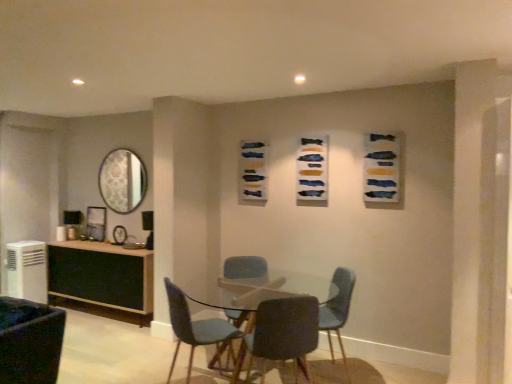
Question: Is textured fabric artwork at center, the third art when ordered from front to back, to the right of clear glass table at center from the viewer's perspective?

Choices:
 (A) yes
 (B) no

Answer: (B)

Question: Can you confirm if textured fabric artwork at center, the 1th art viewed from the back, is taller than clear glass table at center?

Choices:
 (A) yes
 (B) no

Answer: (B)

Question: Is textured fabric artwork at center, the third art when ordered from front to back, outside of clear glass table at center?

Choices:
 (A) yes
 (B) no

Answer: (A)

Question: Is textured fabric artwork at center, which is counted as the 1th art, starting from the left, next to clear glass table at center?

Choices:
 (A) yes
 (B) no

Answer: (B)

Question: Does textured fabric artwork at center, the 1th art viewed from the back, lie behind clear glass table at center?

Choices:
 (A) no
 (B) yes

Answer: (B)

Question: Is velvet blue chair at center, placed as the fourth chair when sorted from left to right, in front of or behind silver/metallic mirror at upper left in the image?

Choices:
 (A) behind
 (B) front

Answer: (B)

Question: Based on their positions, is velvet blue chair at center, which is counted as the 2th chair, starting from the right, located to the left or right of silver/metallic mirror at upper left?

Choices:
 (A) right
 (B) left

Answer: (A)

Question: Looking at the image, does velvet blue chair at center, which is counted as the 2th chair, starting from the right, seem bigger or smaller compared to silver/metallic mirror at upper left?

Choices:
 (A) big
 (B) small

Answer: (A)

Question: From the image's perspective, relative to silver/metallic mirror at upper left, is velvet blue chair at center, which is counted as the 2th chair, starting from the right, above or below?

Choices:
 (A) above
 (B) below

Answer: (B)

Question: From a real-world perspective, is matte blue chair at center, which is the third chair from right to left, physically located above or below velvet dark blue chair at lower left, acting as the first chair starting from the left?

Choices:
 (A) above
 (B) below

Answer: (A)

Question: Does point (266, 274) appear closer or farther from the camera than point (16, 352)?

Choices:
 (A) closer
 (B) farther

Answer: (B)

Question: In the image, is matte blue chair at center, the third chair from the left, positioned in front of or behind velvet dark blue chair at lower left, arranged as the fifth chair when viewed from the right?

Choices:
 (A) front
 (B) behind

Answer: (B)

Question: Is matte blue chair at center, which is the third chair from right to left, inside the boundaries of velvet dark blue chair at lower left, arranged as the fifth chair when viewed from the right, or outside?

Choices:
 (A) inside
 (B) outside

Answer: (B)

Question: Is white plastic air conditioner at lower left to the left or to the right of clear glass table at center in the image?

Choices:
 (A) left
 (B) right

Answer: (A)

Question: Relative to clear glass table at center, is white plastic air conditioner at lower left in front or behind?

Choices:
 (A) front
 (B) behind

Answer: (B)